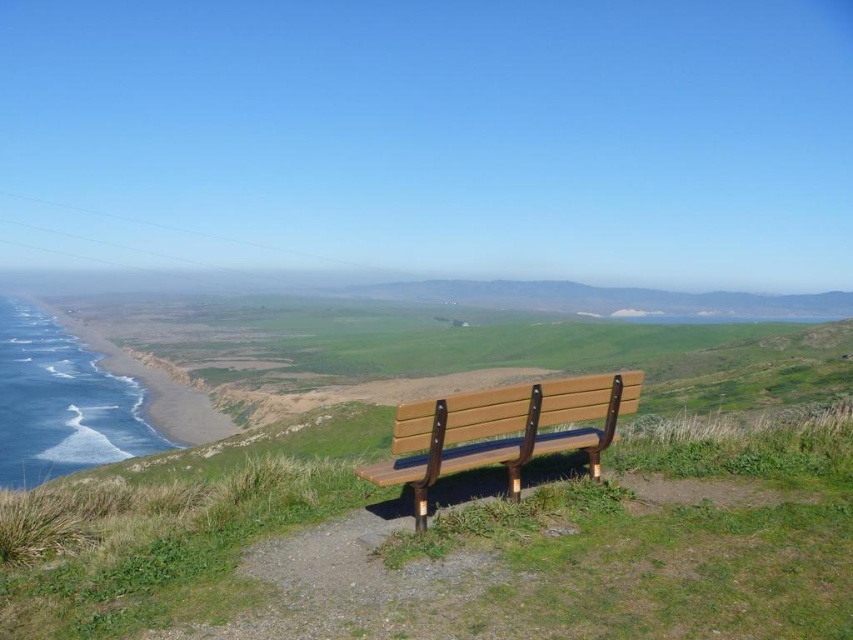
Does point (692, 465) lie behind point (410, 435)?

Yes, point (692, 465) is farther from viewer.

Can you confirm if green grassy at center is thinner than wooden bench at center?

Yes, green grassy at center is thinner than wooden bench at center.

Locate an element on the screen. green grassy at center is located at coordinates (682, 532).

Where is `green grassy at center`? green grassy at center is located at coordinates (682, 532).

Can you confirm if green grassy at center is shorter than blue smooth water at lower left?

Yes.

At what (x,y) coordinates should I click in order to perform the action: click on green grassy at center. Please return your answer as a coordinate pair (x, y). Image resolution: width=853 pixels, height=640 pixels. Looking at the image, I should click on (682, 532).

In order to click on green grassy at center in this screenshot , I will do `click(682, 532)`.

Does blue smooth water at lower left have a smaller size compared to wooden bench at center?

No.

Does blue smooth water at lower left appear on the right side of wooden bench at center?

Incorrect, blue smooth water at lower left is not on the right side of wooden bench at center.

Who is more forward, [129,392] or [357,472]?

Point [357,472] is in front.

You are a GUI agent. You are given a task and a screenshot of the screen. Output one action in this format:
    pyautogui.click(x=<x>, y=<y>)
    Task: Click on the blue smooth water at lower left
    The height and width of the screenshot is (640, 853).
    Given the screenshot: What is the action you would take?
    pyautogui.click(x=61, y=403)